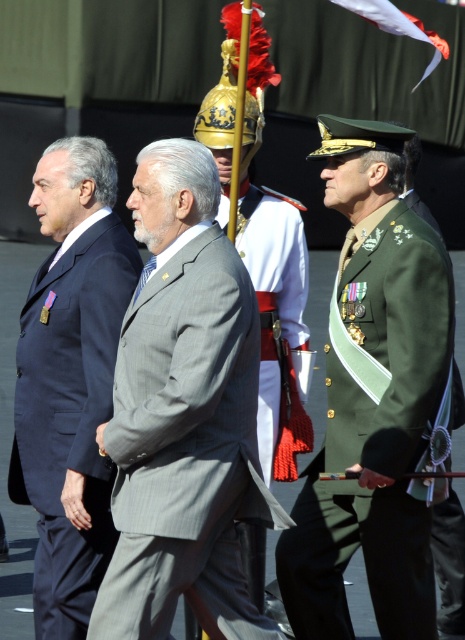
You are a photographer at this event and need to capture a photo where both the green military uniform at center and the white fabric flag at upper center are clearly visible. Given the camera frame can only accommodate objects of a certain width, which object might require adjustment to ensure both fit?

The green military uniform at center is narrower than the white fabric flag at upper center. To ensure both fit in the camera frame, you might need to adjust the angle or zoom to accommodate the wider white fabric flag at upper center.

You are a photographer at this event and need to capture a clear photo of the green military uniform at center without the white fabric flag at upper center blocking it. How can you adjust your position to achieve this?

Move your camera position behind the green military uniform at center so that it is no longer blocking the white fabric flag at upper center.